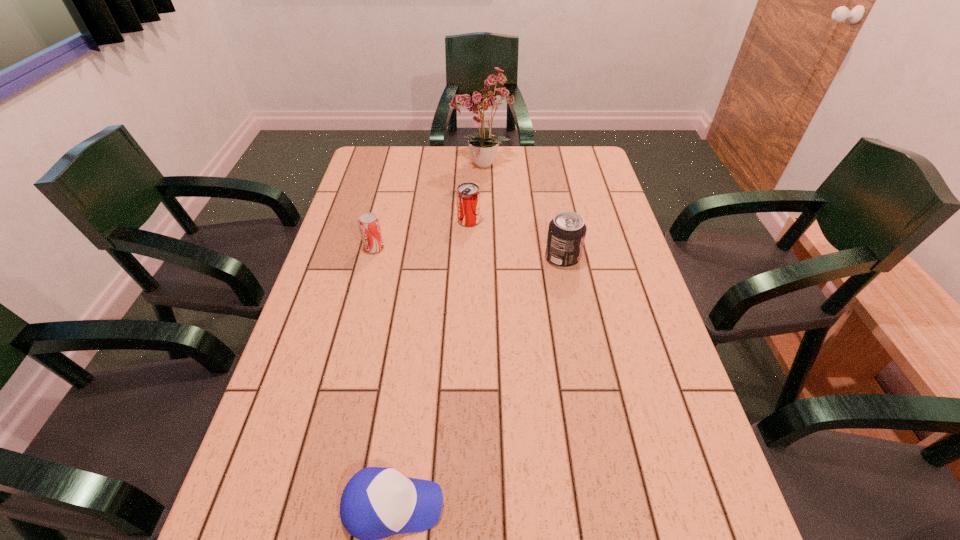
What are the coordinates of `vacant space that's between the leftmost object and the rightmost object` in the screenshot? It's located at [x=468, y=253].

Where is `vacant area that lies between the leftmost soda can and the second soda can from right to left`? vacant area that lies between the leftmost soda can and the second soda can from right to left is located at coordinates (421, 234).

Identify the location of free space between the rightmost soda can and the leftmost soda can. [468, 253].

Image resolution: width=960 pixels, height=540 pixels. What are the coordinates of `vacant space that is in between the tallest object and the leftmost object` in the screenshot? It's located at (428, 207).

In order to click on object that stands as the closest to the baseball cap in this screenshot , I will do `click(566, 234)`.

At what (x,y) coordinates should I click in order to perform the action: click on object that is the third closest one to the farthest object. Please return your answer as a coordinate pair (x, y). Looking at the image, I should click on (369, 225).

Identify which soda can is located as the nearest to the tallest object. Please provide its 2D coordinates. Your answer should be formatted as a tuple, i.e. [(x, y)], where the tuple contains the x and y coordinates of a point satisfying the conditions above.

[(468, 195)]

Where is `soda can that is the second closest to the tallest object`? The height and width of the screenshot is (540, 960). soda can that is the second closest to the tallest object is located at coordinates (566, 234).

Locate an element on the screen. vacant space that satisfies the following two spatial constraints: 1. on the front side of the fourth nearest object; 2. on the logo side of the leftmost object is located at coordinates (468, 248).

At what (x,y) coordinates should I click in order to perform the action: click on free spot that satisfies the following two spatial constraints: 1. on the front-facing side of the flower arrangement; 2. on the right side of the rightmost object. Please return your answer as a coordinate pair (x, y). The image size is (960, 540). Looking at the image, I should click on (482, 258).